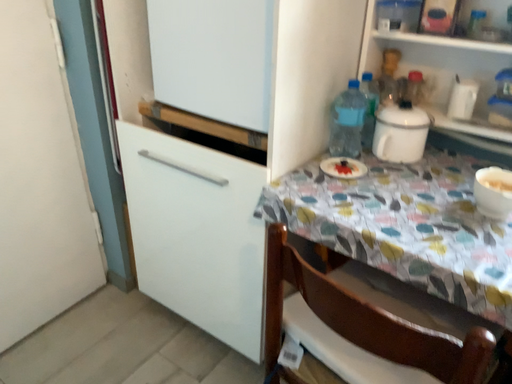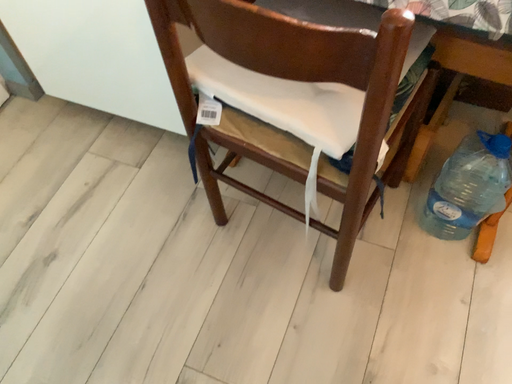
Question: Which way did the camera rotate in the video?

Choices:
 (A) rotated upward
 (B) rotated downward

Answer: (B)